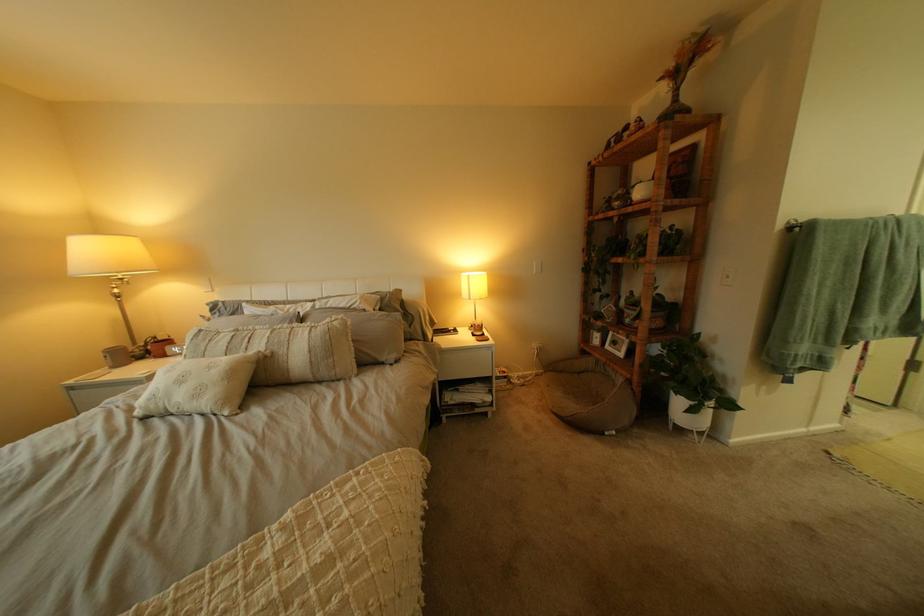
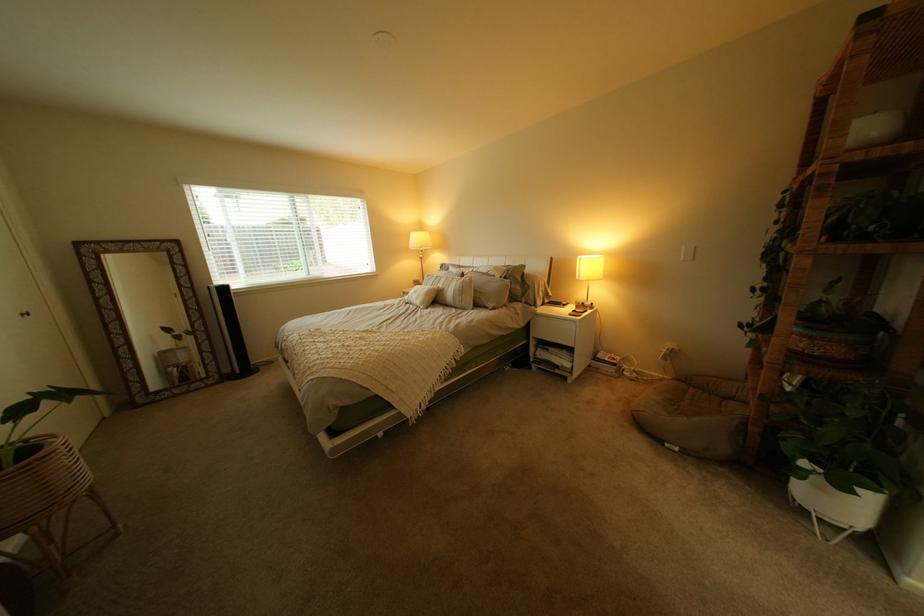
In the second image, find the point that corresponds to [297,353] in the first image.

(462, 290)